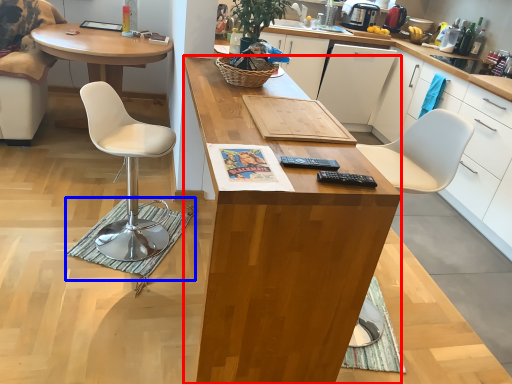
Question: Among these objects, which one is nearest to the camera, desk (highlighted by a red box) or mat (highlighted by a blue box)?

Choices:
 (A) desk
 (B) mat

Answer: (A)